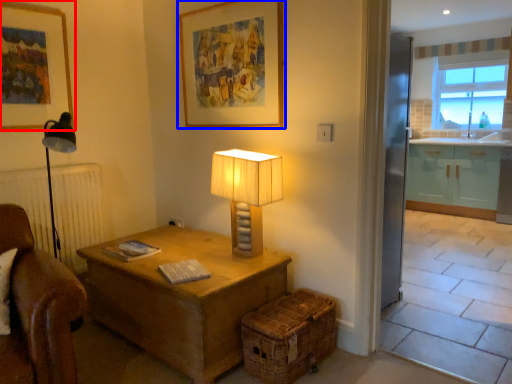
Question: Among these objects, which one is nearest to the camera, picture frame (highlighted by a red box) or picture frame (highlighted by a blue box)?

Choices:
 (A) picture frame
 (B) picture frame

Answer: (B)